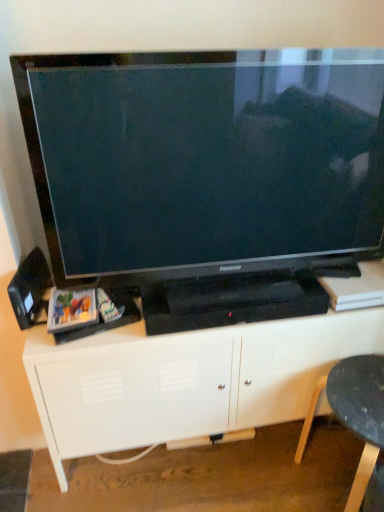
Question: Is white matte entertainment center at center shorter than black plastic chair at lower right?

Choices:
 (A) no
 (B) yes

Answer: (A)

Question: From a real-world perspective, is white matte entertainment center at center over black plastic chair at lower right?

Choices:
 (A) yes
 (B) no

Answer: (A)

Question: Does white matte entertainment center at center appear on the left side of black plastic chair at lower right?

Choices:
 (A) no
 (B) yes

Answer: (B)

Question: Does white matte entertainment center at center have a larger size compared to black plastic chair at lower right?

Choices:
 (A) no
 (B) yes

Answer: (B)

Question: Is white matte entertainment center at center positioned behind black plastic chair at lower right?

Choices:
 (A) yes
 (B) no

Answer: (A)

Question: Is black glossy television at center to the left or to the right of black plastic speaker at left in the image?

Choices:
 (A) left
 (B) right

Answer: (B)

Question: From the image's perspective, is black glossy television at center located above or below black plastic speaker at left?

Choices:
 (A) above
 (B) below

Answer: (A)

Question: Based on their sizes in the image, would you say black glossy television at center is bigger or smaller than black plastic speaker at left?

Choices:
 (A) big
 (B) small

Answer: (A)

Question: Is point (329, 102) closer or farther from the camera than point (23, 268)?

Choices:
 (A) farther
 (B) closer

Answer: (B)

Question: Relative to black plastic chair at lower right, is white matte entertainment center at center in front or behind?

Choices:
 (A) behind
 (B) front

Answer: (A)

Question: Is white matte entertainment center at center wider or thinner than black plastic chair at lower right?

Choices:
 (A) thin
 (B) wide

Answer: (B)

Question: From a real-world perspective, is white matte entertainment center at center physically located above or below black plastic chair at lower right?

Choices:
 (A) above
 (B) below

Answer: (A)

Question: Would you say white matte entertainment center at center is to the left or to the right of black plastic chair at lower right in the picture?

Choices:
 (A) right
 (B) left

Answer: (B)

Question: Based on their positions, is black plastic chair at lower right located to the left or right of black plastic speaker at left?

Choices:
 (A) right
 (B) left

Answer: (A)

Question: Does point (380, 367) appear closer or farther from the camera than point (11, 286)?

Choices:
 (A) farther
 (B) closer

Answer: (A)